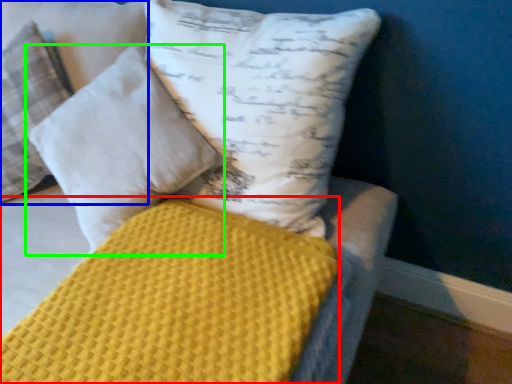
Question: Based on their relative distances, which object is farther from mattress (highlighted by a red box)? Choose from pillow (highlighted by a blue box) and pillow (highlighted by a green box).

Choices:
 (A) pillow
 (B) pillow

Answer: (A)